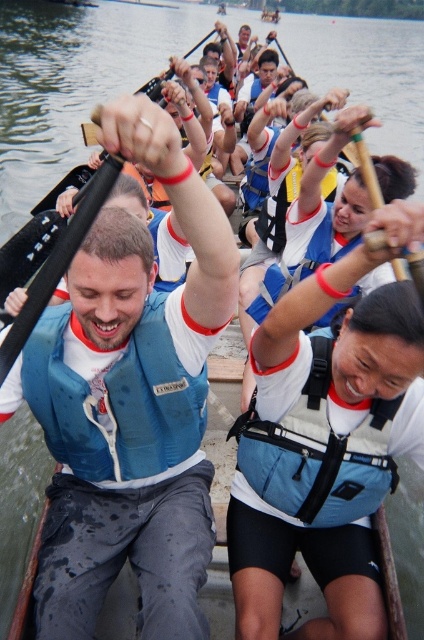
You are a photographer trying to capture a clear shot of both the blue life vest at center and the light blue fabric life jacket at center. Since they are both in the center, how can you position your camera to ensure both are visible in the frame?

Adjust your camera angle slightly so that the blue life vest at center, which is larger, is positioned behind the smaller light blue fabric life jacket at center. This way, both will be visible without one completely blocking the other.